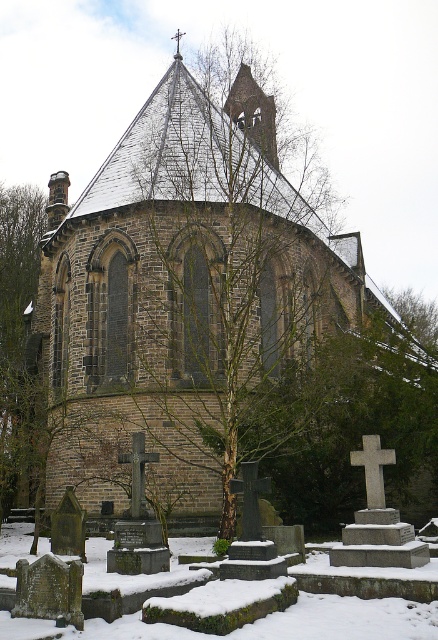
You are standing at the origin point of the coordinate system. The brown stone church at center is located at point 0.452, 0.418. If you want to walk directly towards the church, which direction should you head?

Since the brown stone church at center is located at coordinates (x=183, y=289), you should head in the direction of increasing x and y coordinates to move towards it from the origin.

You are standing at the edge of the cemetery and want to take a photo of the brown stone church at center. Since the white frosty snow at lower center is in the foreground, will you need to adjust your camera angle to include both the church and the snow in the frame?

The brown stone church at center is taller than the white frosty snow at lower center, so you can adjust your camera angle slightly downward to include both the church and the snow in the frame without needing to move your position.

You are standing in the winter scene and want to walk towards the brown stone church at center. Which direction should you walk relative to the white frosty snow at lower center?

The brown stone church at center is positioned on the right side of white frosty snow at lower center, so you should walk towards the right side of the white frosty snow at lower center to reach the church.